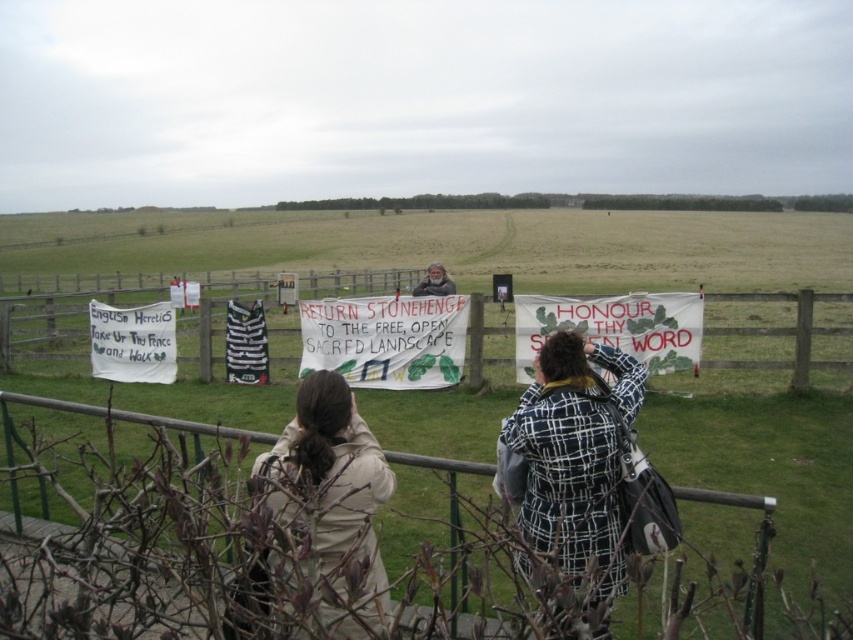
You are standing at the center of the grassy field and want to take a photo of the plaid wool coat at center. According to the scene description, where should you position yourself to capture the coat in the frame?

The plaid wool coat at center is located at point (576, 456), so you should position yourself at the center of the grassy field to capture the coat in the frame since it is already at the center.

You are a photographer trying to capture both the plaid wool coat at center and the tan leather jacket at lower center in a single frame. Based on their sizes, which one will appear larger in your photo?

The plaid wool coat at center will appear larger in the photo because it is bigger than the tan leather jacket at lower center.